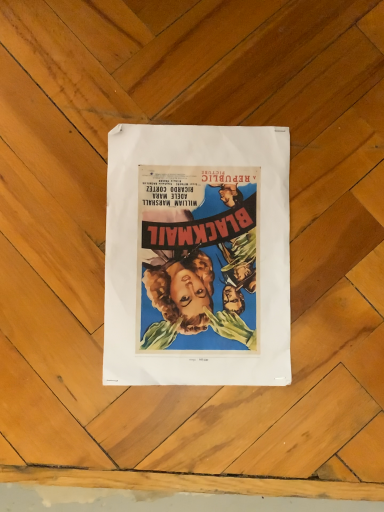
The width and height of the screenshot is (384, 512). Describe the element at coordinates (197, 256) in the screenshot. I see `vibrant paper poster at center` at that location.

Where is `vibrant paper poster at center`? vibrant paper poster at center is located at coordinates (197, 256).

This screenshot has height=512, width=384. What are the coordinates of `vibrant paper poster at center` in the screenshot? It's located at (197, 256).